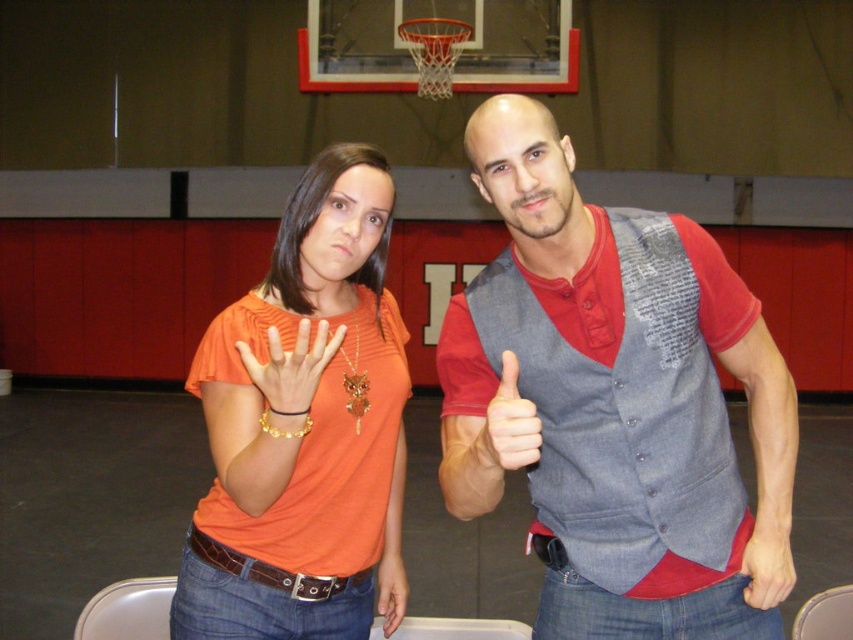
Who is positioned more to the right, orange fabric shirt at left or matte gray hand at lower right?

matte gray hand at lower right

Is orange fabric shirt at left bigger than matte gray hand at lower right?

Yes.

Describe the element at coordinates (300, 422) in the screenshot. This screenshot has height=640, width=853. I see `orange fabric shirt at left` at that location.

I want to click on orange fabric shirt at left, so click(x=300, y=422).

Is denim vest at center positioned at the back of matte gray hand at lower right?

No.

Does denim vest at center appear on the right side of matte gray hand at lower right?

In fact, denim vest at center is to the left of matte gray hand at lower right.

Between point (654, 292) and point (759, 540), which one is positioned behind?

Point (759, 540)

This screenshot has height=640, width=853. What are the coordinates of `denim vest at center` in the screenshot? It's located at 607,394.

Which of these two, orange fabric shirt at left or gold metallic bracelet at center, stands taller?

Standing taller between the two is orange fabric shirt at left.

Describe the element at coordinates (300, 422) in the screenshot. I see `orange fabric shirt at left` at that location.

Identify the location of orange fabric shirt at left. This screenshot has height=640, width=853. (300, 422).